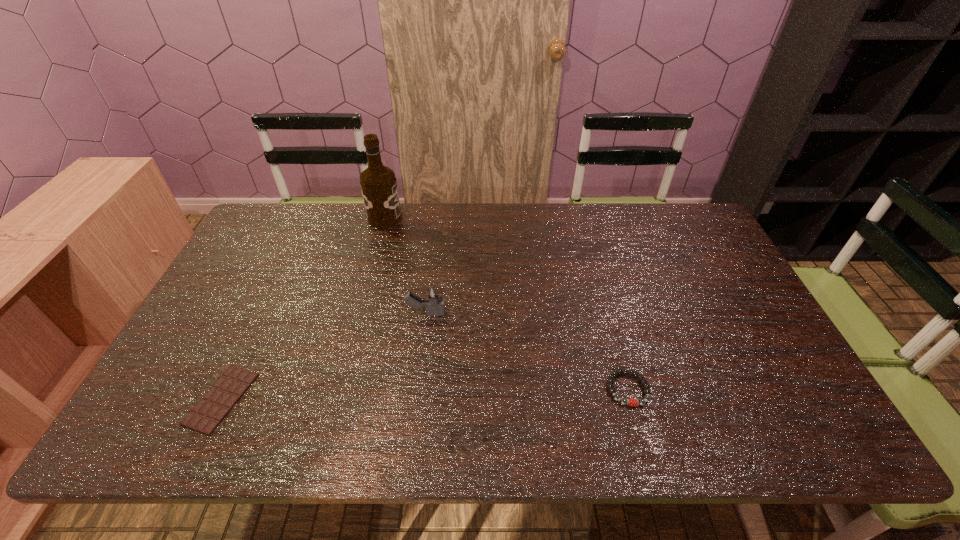
At what (x,y) coordinates should I click in order to perform the action: click on free space located 0.260m on the left of the rightmost object. Please return your answer as a coordinate pair (x, y). This screenshot has width=960, height=540. Looking at the image, I should click on (497, 389).

Find the location of a particular element. The image size is (960, 540). blank area located 0.120m on the back of the chocolate bar is located at coordinates (254, 328).

Where is `object that is at the far edge`? The image size is (960, 540). object that is at the far edge is located at coordinates (378, 183).

At what (x,y) coordinates should I click in order to perform the action: click on object at the near edge. Please return your answer as a coordinate pair (x, y). The height and width of the screenshot is (540, 960). Looking at the image, I should click on (205, 416).

Where is `object positioned at the left edge`? The width and height of the screenshot is (960, 540). object positioned at the left edge is located at coordinates (205, 416).

The width and height of the screenshot is (960, 540). I want to click on object positioned at the near left corner, so click(x=205, y=416).

Where is `vacant space at the far edge`? vacant space at the far edge is located at coordinates (543, 223).

Where is `vacant space at the near edge of the desktop`? This screenshot has height=540, width=960. vacant space at the near edge of the desktop is located at coordinates (262, 447).

Find the location of `free location at the right edge of the desktop`. free location at the right edge of the desktop is located at coordinates (799, 397).

In order to click on free space at the far left corner of the desktop in this screenshot , I will do `click(286, 232)`.